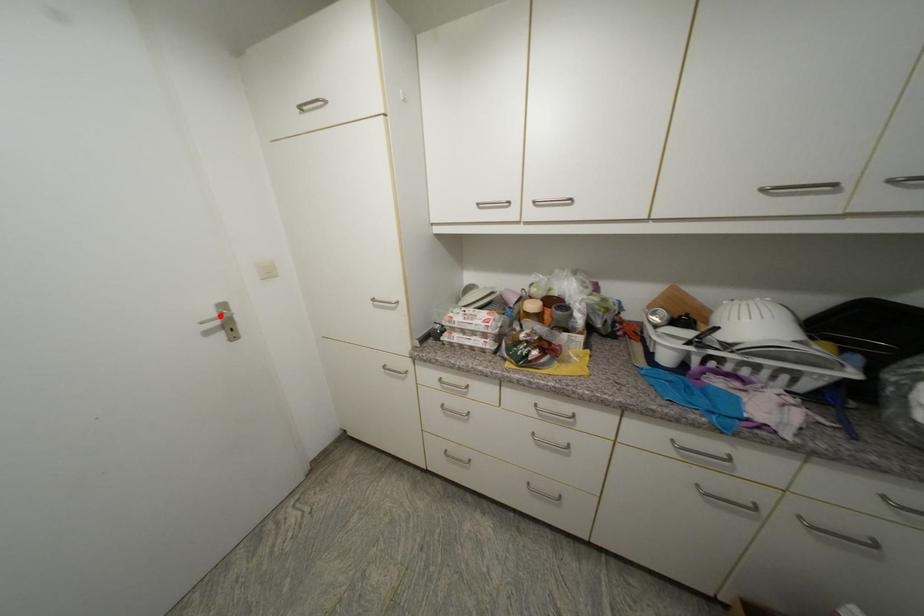
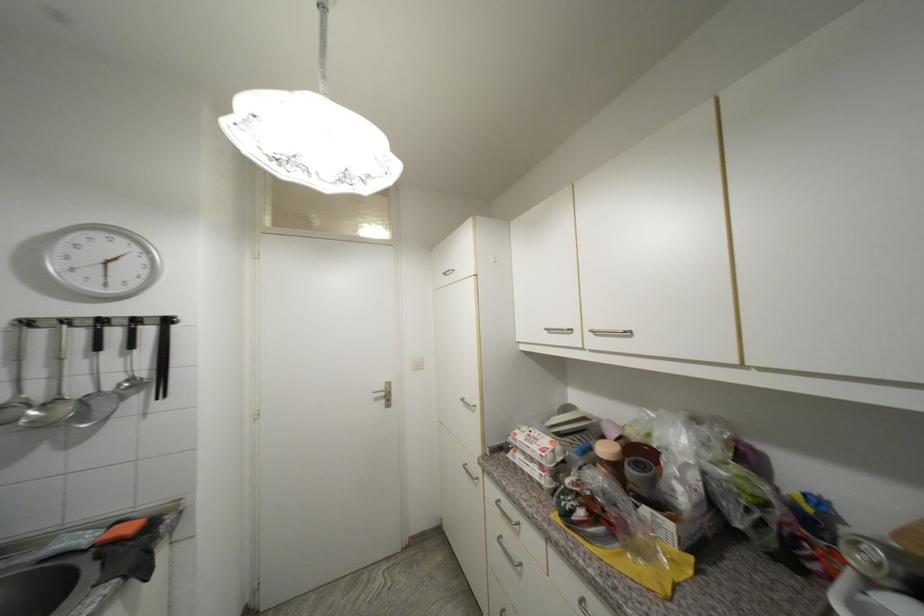
Where in the second image is the point corresponding to the highlighted location from the first image?

(388, 390)